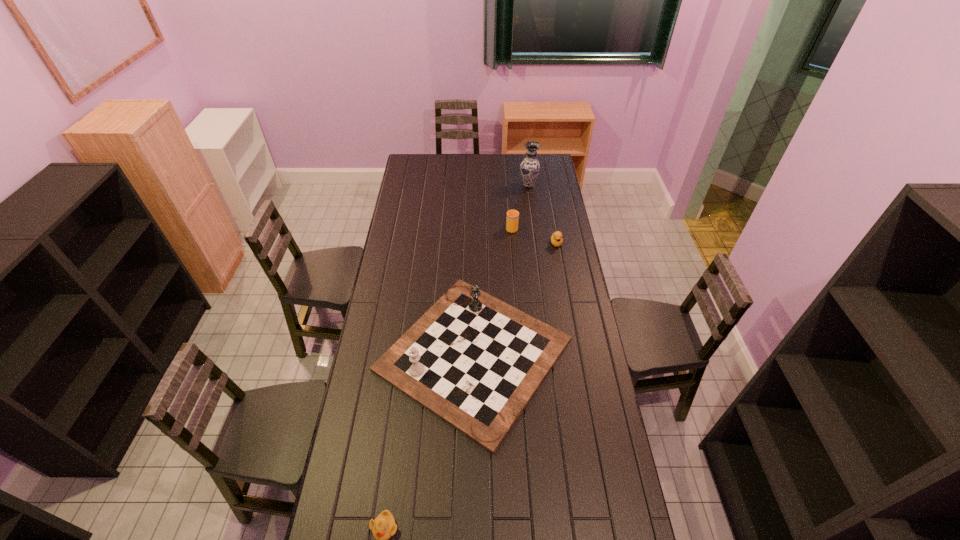
Where is `the tallest object`? This screenshot has width=960, height=540. the tallest object is located at coordinates (530, 167).

What are the coordinates of `vase` in the screenshot? It's located at (530, 167).

Locate an element on the screen. The width and height of the screenshot is (960, 540). gameboard is located at coordinates (474, 361).

Find the location of a particular element. the second tallest object is located at coordinates (474, 361).

The height and width of the screenshot is (540, 960). In order to click on the third shortest object in this screenshot , I will do `click(512, 219)`.

You are a GUI agent. You are given a task and a screenshot of the screen. Output one action in this format:
    pyautogui.click(x=<x>, y=<y>)
    Task: Click on the fourth nearest object
    The image size is (960, 540).
    Given the screenshot: What is the action you would take?
    pyautogui.click(x=512, y=219)

What are the coordinates of `the taller duckling` in the screenshot? It's located at (556, 239).

I want to click on the third farthest object, so click(556, 239).

At what (x,y) coordinates should I click in order to perform the action: click on free space located on the back of the vase. Please return your answer as a coordinate pair (x, y). Looking at the image, I should click on (527, 171).

The height and width of the screenshot is (540, 960). Find the location of `free space located on the back of the fourth farthest object`. free space located on the back of the fourth farthest object is located at coordinates (475, 268).